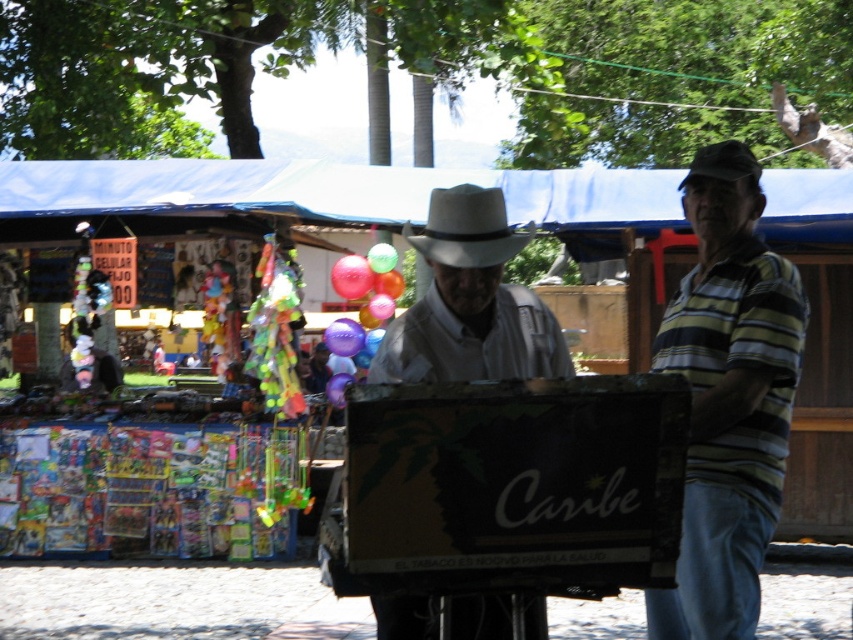
Question: Can you confirm if gray felt fedora at center is thinner than purple glossy balloon at center?

Choices:
 (A) no
 (B) yes

Answer: (A)

Question: Is gray felt fedora at center positioned behind purple glossy balloon at center?

Choices:
 (A) yes
 (B) no

Answer: (B)

Question: Which of the following is the farthest from the observer?

Choices:
 (A) (689, 561)
 (B) (701, 172)

Answer: (B)

Question: Which of the following is the farthest from the observer?

Choices:
 (A) (701, 161)
 (B) (457, 244)

Answer: (A)

Question: Does black felt fedora at center appear on the left side of translucent plastic balloon at center?

Choices:
 (A) yes
 (B) no

Answer: (B)

Question: Considering the real-world distances, which object is farthest from the translucent plastic balloon at center?

Choices:
 (A) purple glossy balloon at center
 (B) black felt fedora at center

Answer: (B)